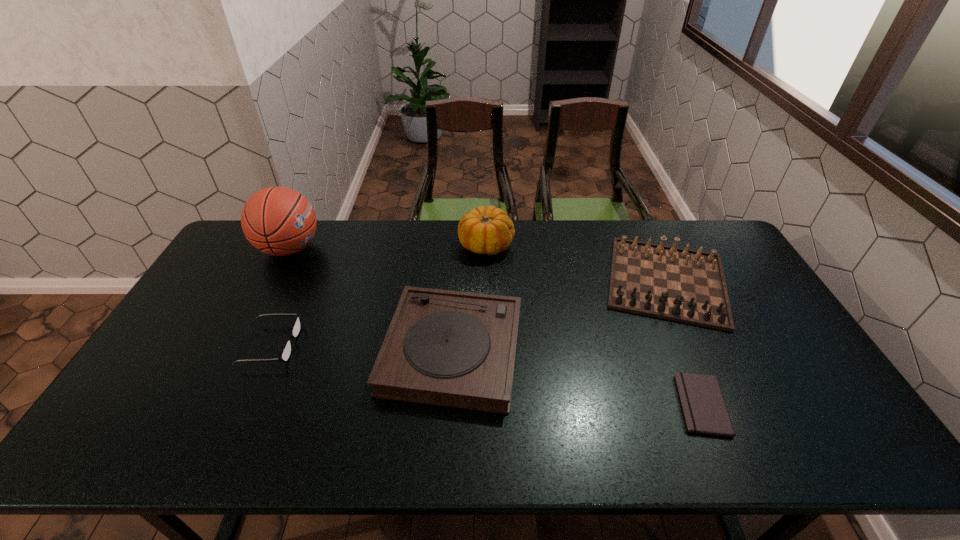
Locate an element on the screen. the tallest object is located at coordinates (279, 221).

You are a GUI agent. You are given a task and a screenshot of the screen. Output one action in this format:
    pyautogui.click(x=<x>, y=<y>)
    Task: Click on the gourd
    
    Given the screenshot: What is the action you would take?
    pyautogui.click(x=488, y=230)

Where is `chessboard`? This screenshot has height=540, width=960. chessboard is located at coordinates (679, 284).

Where is `phonograph record`? phonograph record is located at coordinates point(457,349).

At what (x,y) coordinates should I click in order to perform the action: click on the second shortest object. Please return your answer as a coordinate pair (x, y). Image resolution: width=960 pixels, height=540 pixels. Looking at the image, I should click on (285, 354).

The height and width of the screenshot is (540, 960). I want to click on checkbook, so click(703, 406).

You are a GUI agent. You are given a task and a screenshot of the screen. Output one action in this format:
    pyautogui.click(x=<x>, y=<y>)
    Task: Click on the vacant area situated 0.190m on the logo side of the basketball
    The width and height of the screenshot is (960, 540).
    Given the screenshot: What is the action you would take?
    pyautogui.click(x=375, y=248)

You are a GUI agent. You are given a task and a screenshot of the screen. Output one action in this format:
    pyautogui.click(x=<x>, y=<y>)
    Task: Click on the vacant space located 0.270m on the left of the gourd
    
    Given the screenshot: What is the action you would take?
    pyautogui.click(x=383, y=245)

Where is `vacant space situated on the left of the chessboard`? This screenshot has width=960, height=540. vacant space situated on the left of the chessboard is located at coordinates (560, 281).

Locate an element on the screen. The image size is (960, 540). free space located 0.210m on the back of the phonograph record is located at coordinates (458, 257).